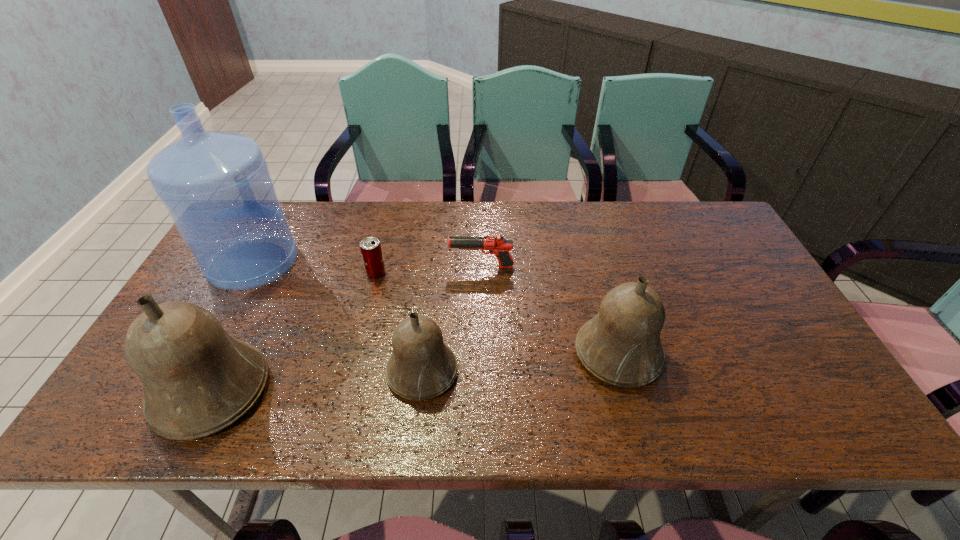
The image size is (960, 540). I want to click on empty location between the leftmost bell and the second bell from right to left, so click(x=318, y=381).

At what (x,y) coordinates should I click in order to perform the action: click on free area in between the beer can and the water jug. Please return your answer as a coordinate pair (x, y). The width and height of the screenshot is (960, 540). Looking at the image, I should click on (315, 268).

Locate an element on the screen. Image resolution: width=960 pixels, height=540 pixels. vacant point located between the beer can and the water jug is located at coordinates (315, 268).

You are a GUI agent. You are given a task and a screenshot of the screen. Output one action in this format:
    pyautogui.click(x=<x>, y=<y>)
    Task: Click on the free point between the leftmost bell and the tallest object
    This screenshot has height=540, width=960.
    Given the screenshot: What is the action you would take?
    pyautogui.click(x=232, y=327)

Locate an element on the screen. unoccupied position between the rightmost bell and the water jug is located at coordinates 436,308.

At what (x,y) coordinates should I click in order to perform the action: click on the closest object to the gun. Please return your answer as a coordinate pair (x, y). The height and width of the screenshot is (540, 960). Looking at the image, I should click on (371, 251).

Locate which object ranks fourth in proximity to the third object from left to right. Please provide its 2D coordinates. Your answer should be formatted as a tuple, i.e. [(x, y)], where the tuple contains the x and y coordinates of a point satisfying the conditions above.

[(198, 379)]

The image size is (960, 540). I want to click on the closest bell to the fourth tallest object, so click(198, 379).

Find the location of a particular element. The width and height of the screenshot is (960, 540). bell that stands as the third closest to the gun is located at coordinates (198, 379).

The width and height of the screenshot is (960, 540). Identify the location of free space that satisfies the following two spatial constraints: 1. at the aiming end of the gun; 2. on the back side of the rightmost bell. (482, 354).